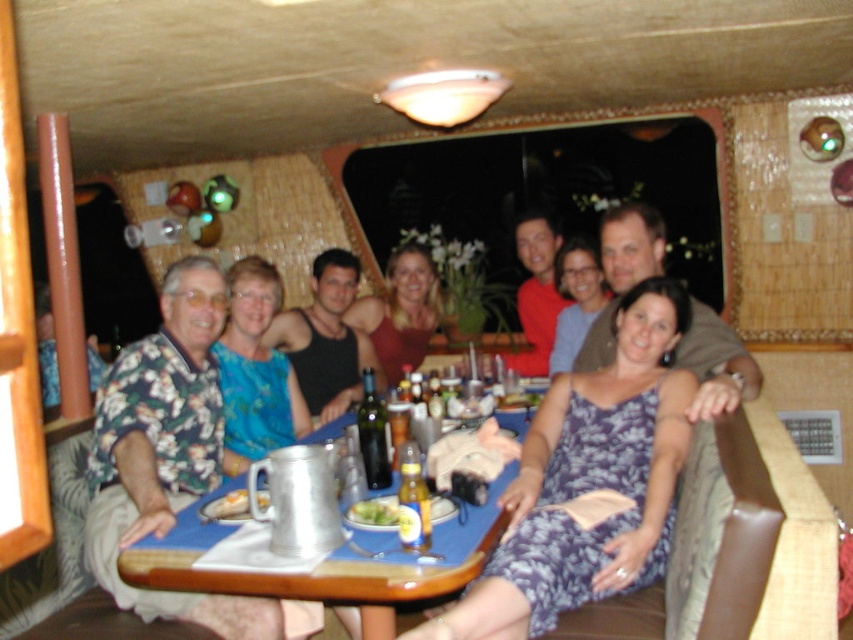
You are a waiter in a boat dining area. You need to place an order at the exact center of the table. The table is the brushed metal table at center. Where should you place the order relative to the table?

The exact center of the table is at point [296,573], so you should place the order there.

You are a guest at the dining table and want to reach the brushed metal table at center to grab a drink. Considering your arm span is 5 feet, can you comfortably reach the table without moving your chair?

The brushed metal table at center is 5.36 feet away from you, which is slightly beyond your arm span of 5 feet. You might need to adjust your position slightly to reach it comfortably.

You are planning to place a new decorative item on the table. Considering the space occupied by the brushed metal table at center and the matte red dress at center, which object allows more room for the new item?

The matte red dress at center occupies more space than the brushed metal table at center, so placing the new item on the brushed metal table at center would allow more room.